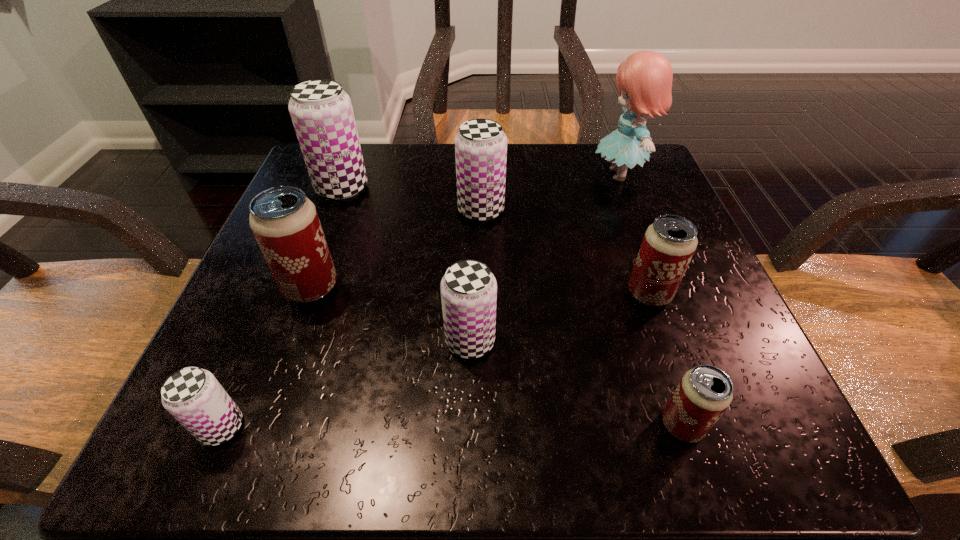
Identify the location of empty space that is in between the smallest red beer can and the nearest purple beer can. This screenshot has height=540, width=960. pos(452,426).

Locate an element on the screen. vacant area that lies between the nearest purple beer can and the second tallest object is located at coordinates (281, 308).

Where is `vacant region between the third smallest purple beer can and the biggest red beer can`? The width and height of the screenshot is (960, 540). vacant region between the third smallest purple beer can and the biggest red beer can is located at coordinates (396, 249).

Locate which object ranks sixth in proximity to the second nearest purple beer can. Please provide its 2D coordinates. Your answer should be formatted as a tuple, i.e. [(x, y)], where the tuple contains the x and y coordinates of a point satisfying the conditions above.

[(321, 111)]

In order to click on object identified as the third closest to the nearest red beer can in this screenshot , I will do 480,145.

Locate which beer can ranks fifth in proximity to the second nearest purple beer can. Please provide its 2D coordinates. Your answer should be formatted as a tuple, i.e. [(x, y)], where the tuple contains the x and y coordinates of a point satisfying the conditions above.

[(193, 396)]

Find the location of a particular element. The height and width of the screenshot is (540, 960). the second closest beer can relative to the second smallest red beer can is located at coordinates (468, 289).

Find the location of a particular element. the second closest purple beer can to the second biggest purple beer can is located at coordinates (468, 289).

Choose which purple beer can is the third nearest neighbor to the third biggest purple beer can. Please provide its 2D coordinates. Your answer should be formatted as a tuple, i.e. [(x, y)], where the tuple contains the x and y coordinates of a point satisfying the conditions above.

[(321, 111)]

Where is `red beer can that stands as the second closest to the tallest object`? red beer can that stands as the second closest to the tallest object is located at coordinates (704, 393).